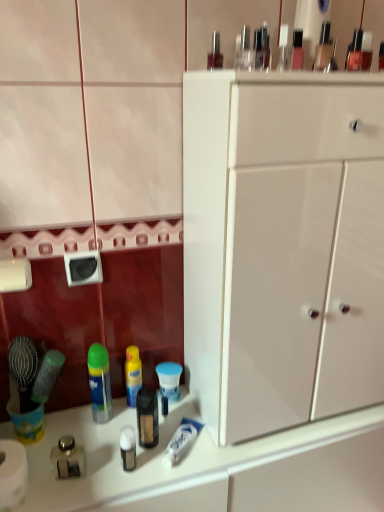
The image size is (384, 512). I want to click on empty space that is to the right of clear glass jar at lower left, the 2th toiletry from the back, so (128, 474).